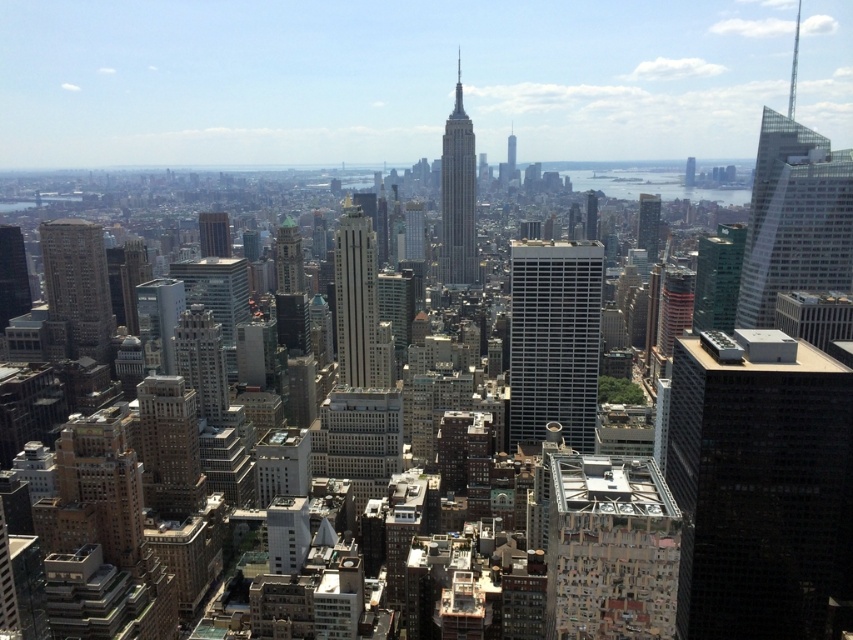
Question: Among these objects, which one is nearest to the camera?

Choices:
 (A) textured concrete building at center
 (B) glassy reflective skyscraper at center

Answer: (A)

Question: Is glassy reflective skyscraper at upper right bigger than gray concrete skyscraper at center?

Choices:
 (A) yes
 (B) no

Answer: (A)

Question: Is black glass building at right smaller than green glass building at center-right?

Choices:
 (A) no
 (B) yes

Answer: (A)

Question: Among these points, which one is nearest to the camera?

Choices:
 (A) (833, 182)
 (B) (646, 216)

Answer: (B)

Question: Estimate the real-world distances between objects in this image. Which object is closer to the glassy reflective skyscraper at center-right?

Choices:
 (A) matte gray skyscraper at center-left
 (B) glassy reflective skyscraper at center
 (C) brown brick building at left

Answer: (B)

Question: Is textured concrete building at center to the right of brown brick building at left from the viewer's perspective?

Choices:
 (A) yes
 (B) no

Answer: (A)